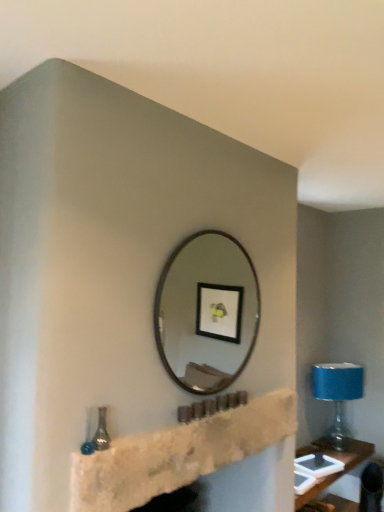
Question: In terms of height, does stone fireplace at center look taller or shorter compared to metallic silver mirror at center?

Choices:
 (A) short
 (B) tall

Answer: (A)

Question: Considering their positions, is stone fireplace at center located in front of or behind metallic silver mirror at center?

Choices:
 (A) front
 (B) behind

Answer: (A)

Question: Considering the real-world distances, which object is farthest from the metallic silver mirror at center?

Choices:
 (A) blue fabric lampshade at right
 (B) stone fireplace at center

Answer: (B)

Question: Estimate the real-world distances between objects in this image. Which object is farther from the blue fabric lampshade at right?

Choices:
 (A) stone fireplace at center
 (B) metallic silver mirror at center

Answer: (A)